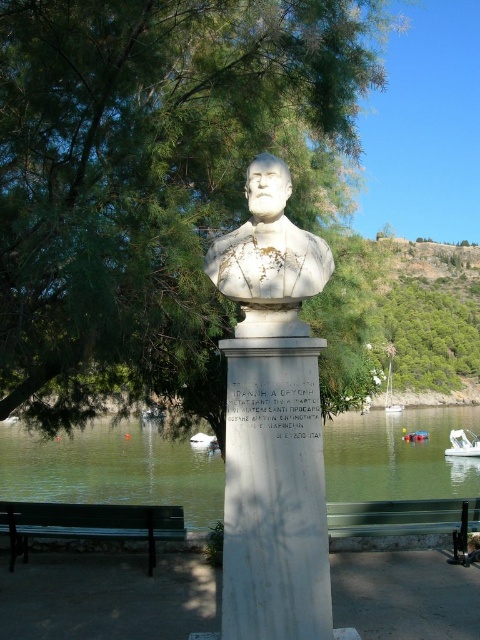
Who is higher up, white marble bust at center or green painted wood bench at lower left?

white marble bust at center is higher up.

Between white marble bust at center and green painted wood bench at lower left, which one appears on the right side from the viewer's perspective?

Positioned to the right is white marble bust at center.

This screenshot has height=640, width=480. Find the location of `white marble bust at center`. white marble bust at center is located at coordinates (273, 420).

Who is more distant from viewer, (232, 269) or (47, 520)?

Positioned behind is point (47, 520).

The image size is (480, 640). I want to click on white stone bust at center, so click(x=268, y=257).

Who is taller, green leafy tree at upper left or green water at lower center?

green leafy tree at upper left is taller.

Does green leafy tree at upper left appear under green water at lower center?

Actually, green leafy tree at upper left is above green water at lower center.

The image size is (480, 640). What do you see at coordinates (156, 176) in the screenshot?
I see `green leafy tree at upper left` at bounding box center [156, 176].

The height and width of the screenshot is (640, 480). What are the coordinates of `green leafy tree at upper left` in the screenshot? It's located at (156, 176).